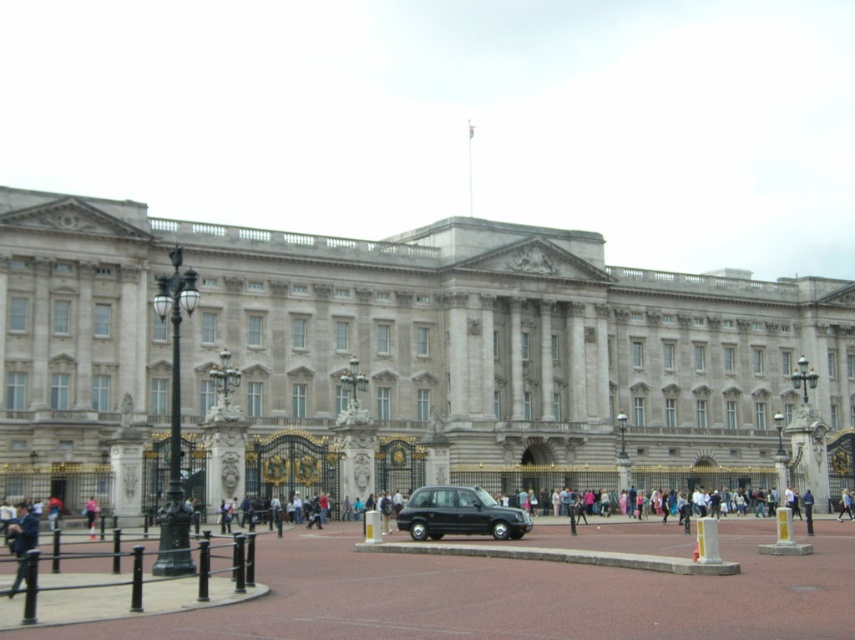
Between blue denim jacket at lower right and pink fabric at center, which one is positioned lower?

blue denim jacket at lower right

Does point (811, 531) come behind point (84, 515)?

No, it is not.

Locate an element on the screen. Image resolution: width=855 pixels, height=640 pixels. blue denim jacket at lower right is located at coordinates [806, 509].

Is black rubber taxi at center smaller than blue denim jacket at lower left?

Indeed, black rubber taxi at center has a smaller size compared to blue denim jacket at lower left.

Can you confirm if black rubber taxi at center is thinner than blue denim jacket at lower left?

Correct, black rubber taxi at center's width is less than blue denim jacket at lower left's.

Is point (505, 524) positioned behind point (30, 518)?

Yes.

Where is `black rubber taxi at center`? This screenshot has height=640, width=855. black rubber taxi at center is located at coordinates (458, 515).

This screenshot has width=855, height=640. Describe the element at coordinates (404, 339) in the screenshot. I see `gray stone palace at center` at that location.

Does point (677, 310) come in front of point (13, 541)?

No, (677, 310) is behind (13, 541).

I want to click on gray stone palace at center, so click(404, 339).